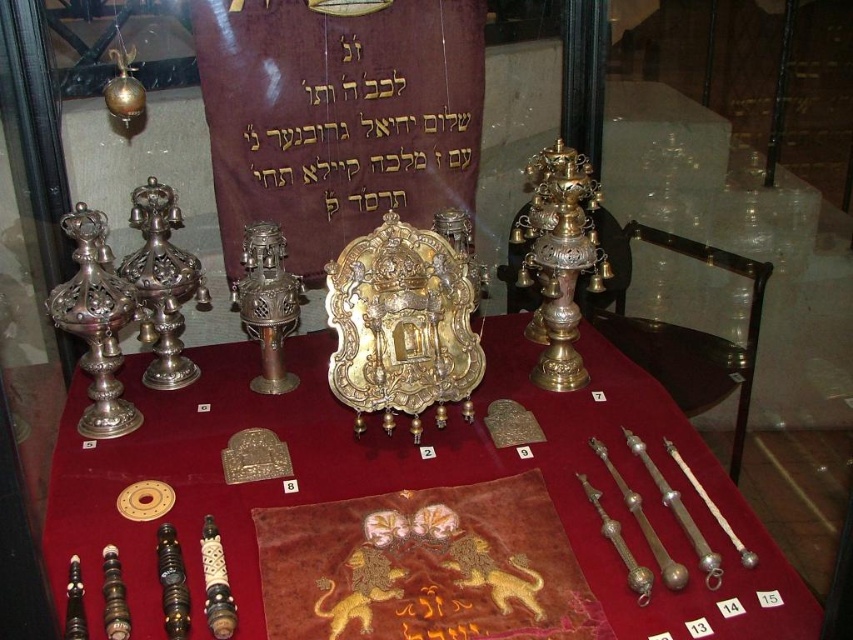
Question: Can you confirm if shiny gold plate at center is bigger than gold metallic text at center?

Choices:
 (A) yes
 (B) no

Answer: (A)

Question: Does shiny gold plate at center come in front of gold metallic text at center?

Choices:
 (A) yes
 (B) no

Answer: (A)

Question: Is shiny gold plate at center closer to camera compared to gold metallic text at center?

Choices:
 (A) no
 (B) yes

Answer: (B)

Question: Which point is closer to the camera?

Choices:
 (A) (281, 218)
 (B) (798, 580)

Answer: (B)

Question: Which point is farther to the camera?

Choices:
 (A) (370, 157)
 (B) (366, 444)

Answer: (A)